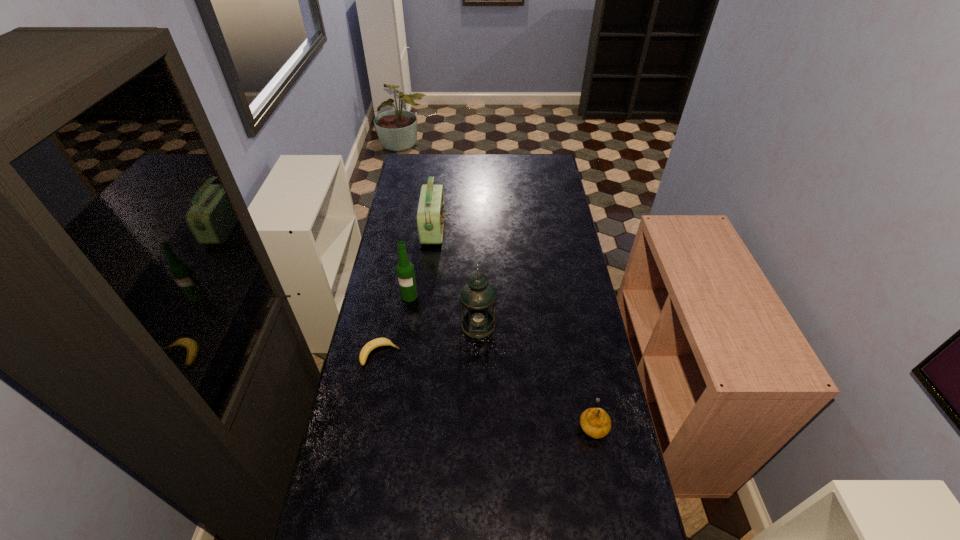
The image size is (960, 540). What are the coordinates of `free space between the radio receiver and the oil lamp` in the screenshot? It's located at (456, 277).

At what (x,y) coordinates should I click in order to perform the action: click on free space between the beer bottle and the oil lamp. Please return your answer as a coordinate pair (x, y). This screenshot has width=960, height=540. Looking at the image, I should click on (444, 310).

Locate which object is the closest to the radio receiver. Please provide its 2D coordinates. Your answer should be formatted as a tuple, i.e. [(x, y)], where the tuple contains the x and y coordinates of a point satisfying the conditions above.

[(405, 270)]

Where is `object that is the fourth nearest to the farthest object`? object that is the fourth nearest to the farthest object is located at coordinates (595, 422).

You are a GUI agent. You are given a task and a screenshot of the screen. Output one action in this format:
    pyautogui.click(x=<x>, y=<y>)
    Task: Click on the blank area in the image that satisfies the following two spatial constraints: 1. on the front panel of the farthest object; 2. on the left side of the pear
    The image size is (960, 540).
    Given the screenshot: What is the action you would take?
    pyautogui.click(x=411, y=424)

Where is `vacant position in the image that satisfies the following two spatial constraints: 1. on the front panel of the farthest object; 2. on the front side of the second nearest object`? Image resolution: width=960 pixels, height=540 pixels. vacant position in the image that satisfies the following two spatial constraints: 1. on the front panel of the farthest object; 2. on the front side of the second nearest object is located at coordinates (419, 354).

The width and height of the screenshot is (960, 540). In order to click on vacant space that satisfies the following two spatial constraints: 1. on the label of the oil lamp; 2. on the left side of the beer bottle in this screenshot , I will do `click(405, 325)`.

Locate an element on the screen. free spot that satisfies the following two spatial constraints: 1. on the front panel of the rightmost object; 2. on the left side of the radio receiver is located at coordinates (411, 424).

Identify the location of vacant point that satisfies the following two spatial constraints: 1. on the label of the nearest object; 2. on the right side of the second tallest object. The height and width of the screenshot is (540, 960). (390, 424).

Locate an element on the screen. The image size is (960, 540). vacant point that satisfies the following two spatial constraints: 1. on the front panel of the rightmost object; 2. on the right side of the farthest object is located at coordinates (411, 424).